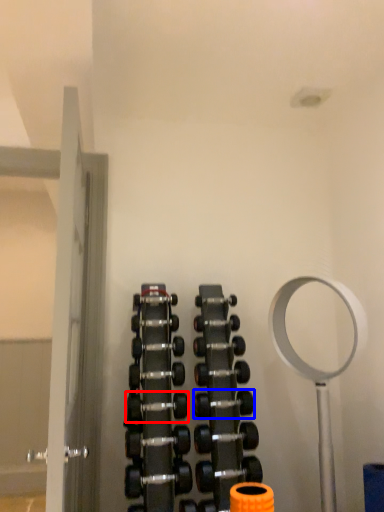
Question: Among these objects, which one is nearest to the camera, dumbbell (highlighted by a red box) or dumbbell (highlighted by a blue box)?

Choices:
 (A) dumbbell
 (B) dumbbell

Answer: (A)